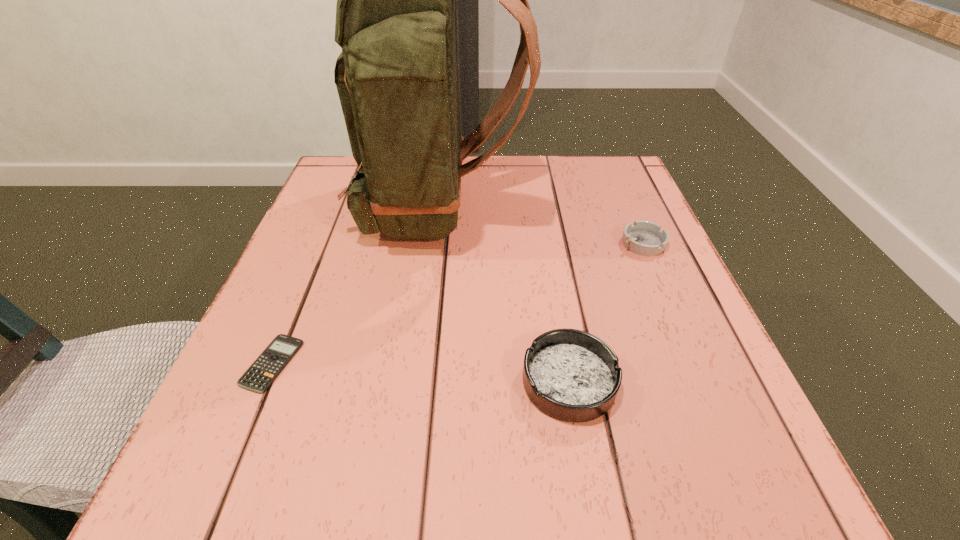
The height and width of the screenshot is (540, 960). I want to click on vacant space at the far right corner, so click(x=626, y=200).

The width and height of the screenshot is (960, 540). Identify the location of vacant space at the near right corner of the desktop. (676, 448).

Locate an element on the screen. The image size is (960, 540). free spot between the calculator and the second shortest object is located at coordinates (457, 303).

At what (x,y) coordinates should I click in order to perform the action: click on free space that is in between the tallest object and the nearer ashtray. Please return your answer as a coordinate pair (x, y). Looking at the image, I should click on (504, 295).

The height and width of the screenshot is (540, 960). What are the coordinates of `vacant area that lies between the right ashtray and the leftmost object` in the screenshot? It's located at (457, 303).

Find the location of `vacant area that lies between the second tallest object and the tallest object`. vacant area that lies between the second tallest object and the tallest object is located at coordinates pyautogui.click(x=504, y=295).

At what (x,y) coordinates should I click in order to perform the action: click on empty location between the shortest object and the farther ashtray. Please return your answer as a coordinate pair (x, y). This screenshot has width=960, height=540. Looking at the image, I should click on (457, 303).

Where is `blank region between the leftmost object and the shorter ashtray`? This screenshot has width=960, height=540. blank region between the leftmost object and the shorter ashtray is located at coordinates (457, 303).

The image size is (960, 540). I want to click on blank region between the backpack and the calculator, so click(356, 286).

The width and height of the screenshot is (960, 540). Find the location of `vacant space that is in between the shorter ashtray and the tallest object`. vacant space that is in between the shorter ashtray and the tallest object is located at coordinates (541, 226).